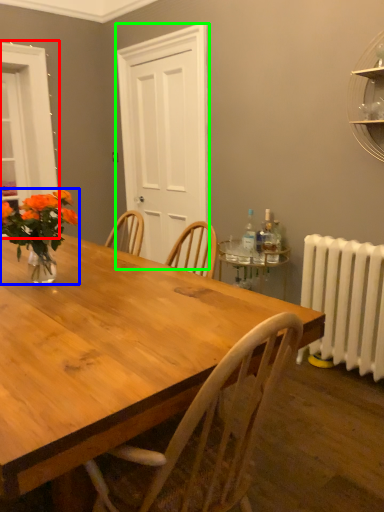
Question: Which is farther away from window (highlighted by a red box)? houseplant (highlighted by a blue box) or glass door (highlighted by a green box)?

Choices:
 (A) houseplant
 (B) glass door

Answer: (A)